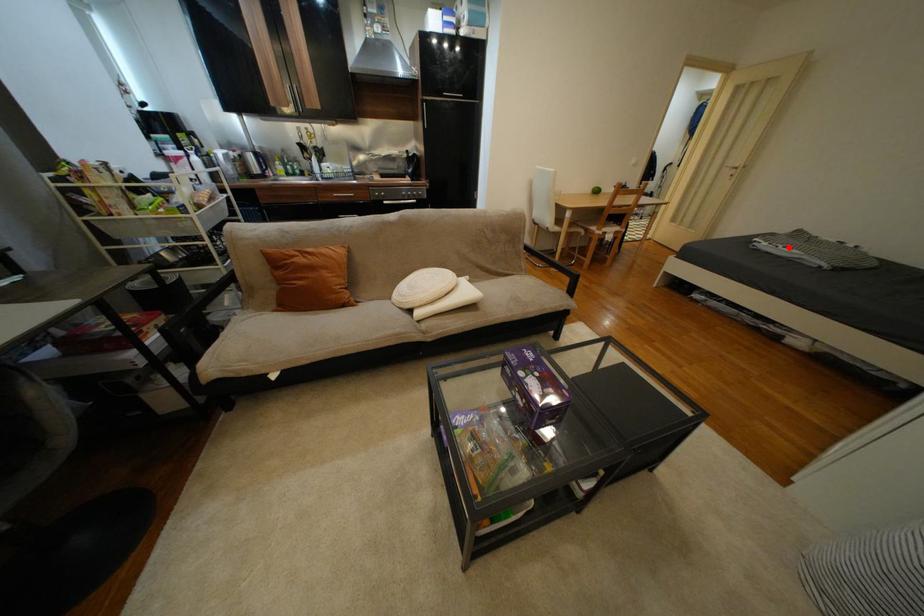
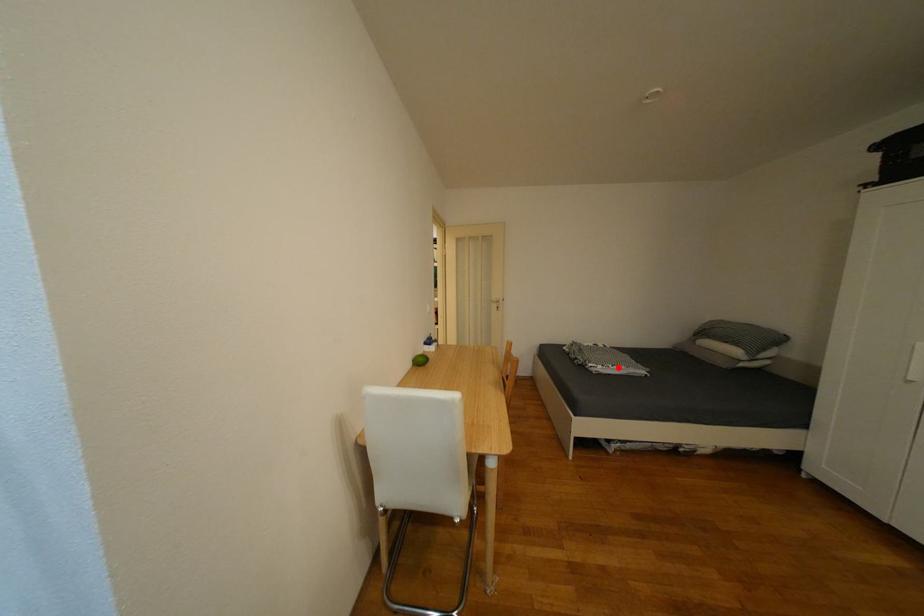
I am providing you with two images of the same scene from different viewpoints. A red point is marked on the first image and another point is marked on the second image. Are the points marked in image1 and image2 representing the same 3D position?

Yes